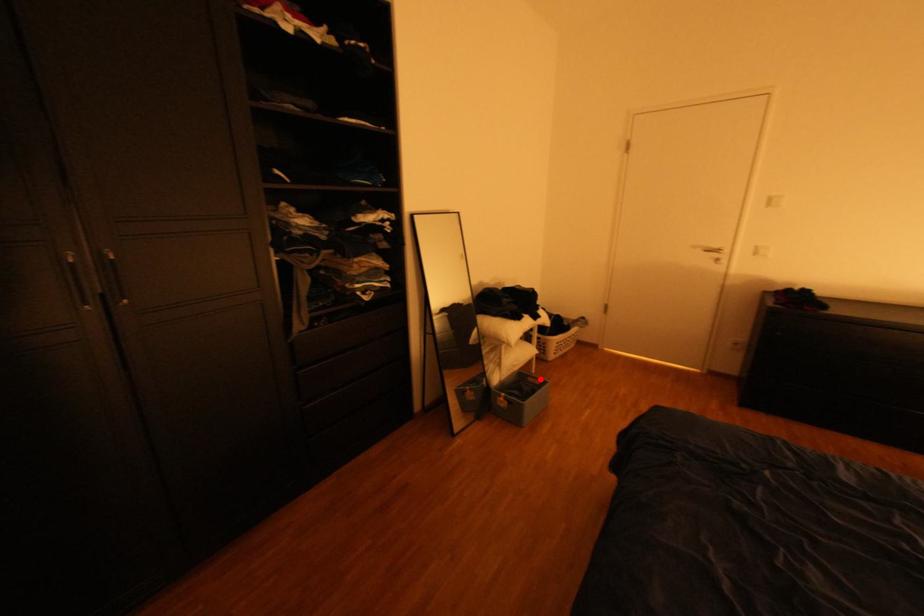
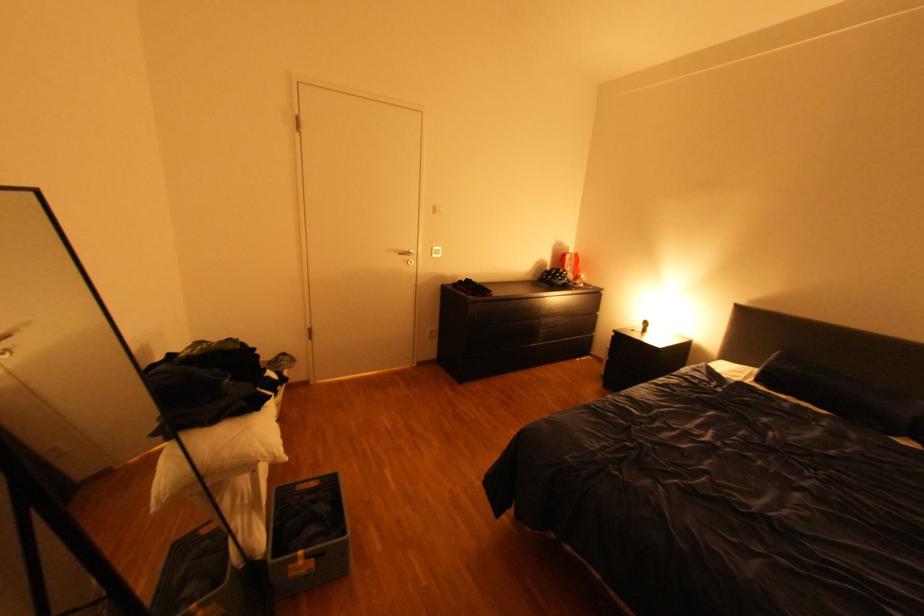
Question: I am providing you with two images of the same scene from different viewpoints. A red point is shown in image1. For the corresponding object point in image2, is it positioned nearer or farther from the camera?

Choices:
 (A) Nearer
 (B) Farther

Answer: (B)